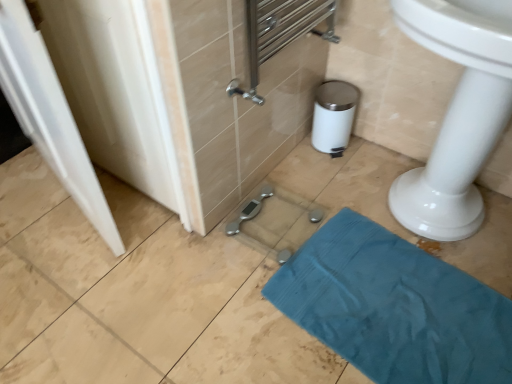
Question: Do you think teal fabric towel at lower right is within white glossy door at left, or outside of it?

Choices:
 (A) inside
 (B) outside

Answer: (B)

Question: From a real-world perspective, is teal fabric towel at lower right above or below white glossy door at left?

Choices:
 (A) below
 (B) above

Answer: (A)

Question: Visually, is teal fabric towel at lower right positioned to the left or to the right of white glossy door at left?

Choices:
 (A) left
 (B) right

Answer: (B)

Question: Do you think white glossy door at left is within teal fabric towel at lower right, or outside of it?

Choices:
 (A) outside
 (B) inside

Answer: (A)

Question: From a real-world perspective, relative to teal fabric towel at lower right, is white glossy door at left vertically above or below?

Choices:
 (A) below
 (B) above

Answer: (B)

Question: Based on their sizes in the image, would you say white glossy door at left is bigger or smaller than teal fabric towel at lower right?

Choices:
 (A) small
 (B) big

Answer: (B)

Question: Is point (24, 99) closer or farther from the camera than point (465, 339)?

Choices:
 (A) farther
 (B) closer

Answer: (A)